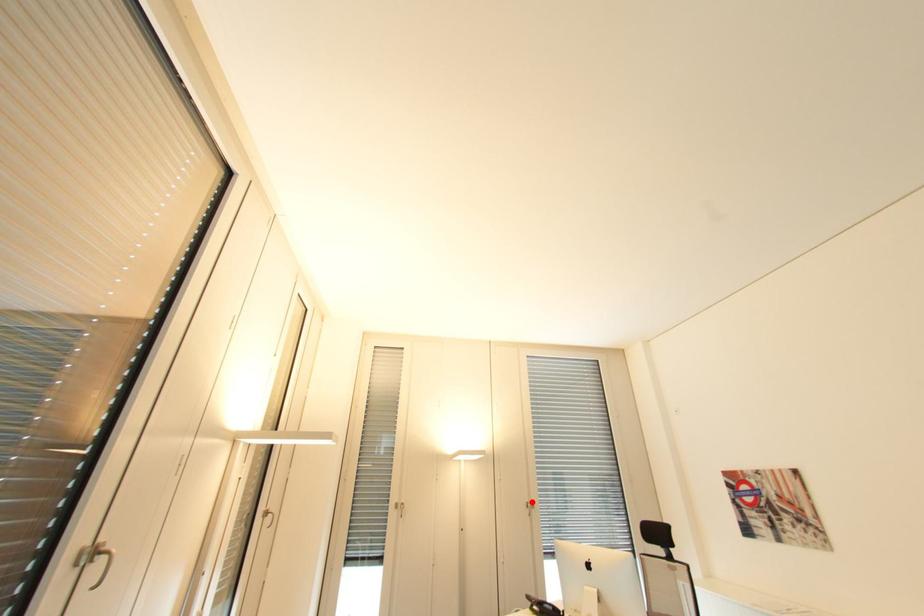
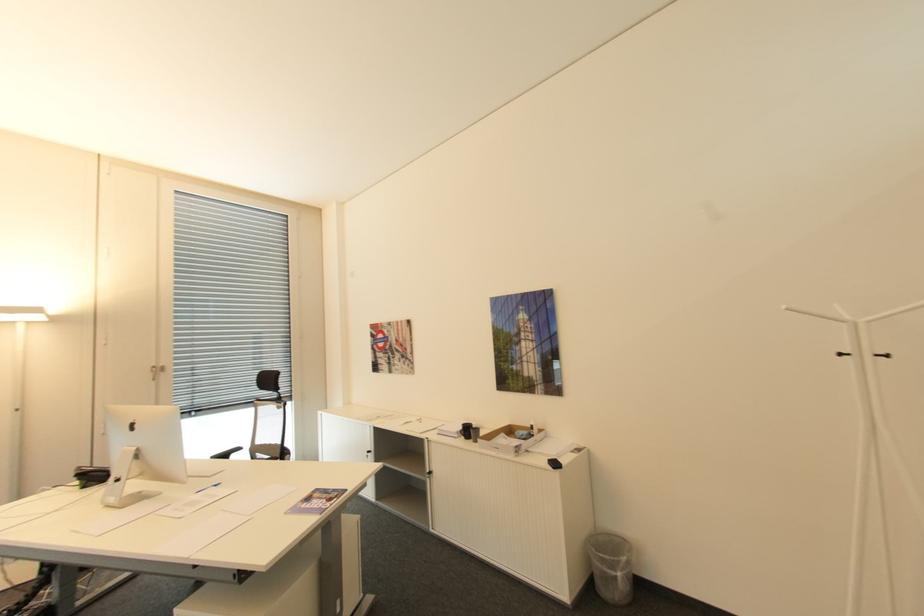
Find the pixel in the second image that matches the highlighted location in the first image.

(159, 367)